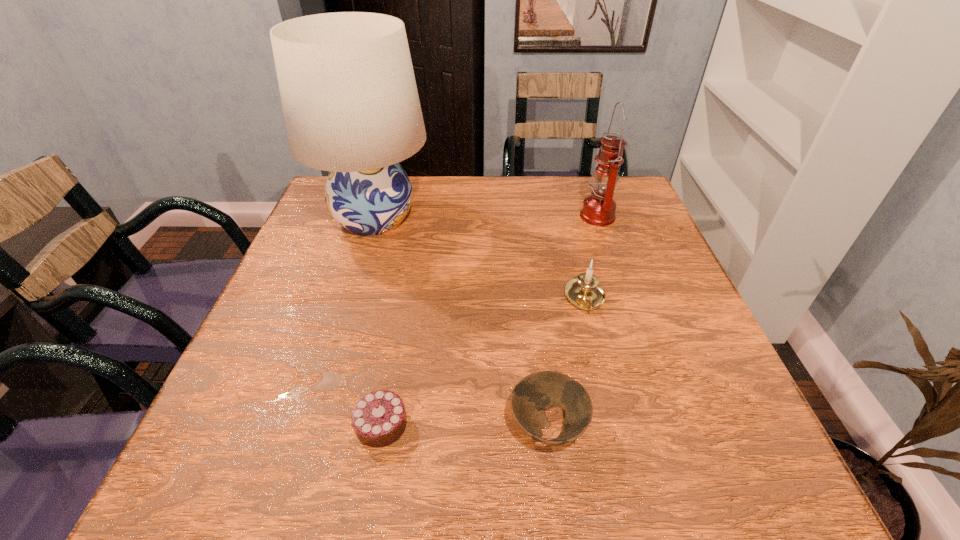
Locate an element on the screen. The width and height of the screenshot is (960, 540). lampshade is located at coordinates (350, 102).

Locate an element on the screen. The height and width of the screenshot is (540, 960). the fourth shortest object is located at coordinates (599, 208).

This screenshot has height=540, width=960. Find the location of `the third farthest object`. the third farthest object is located at coordinates (584, 291).

I want to click on the third shortest object, so click(x=584, y=291).

Identify the location of the fourth tallest object. This screenshot has width=960, height=540. (535, 393).

This screenshot has width=960, height=540. What are the coordinates of `the third object from left to right` in the screenshot? It's located at (535, 393).

At what (x,y) coordinates should I click in order to perform the action: click on the shortest object. Please return your answer as a coordinate pair (x, y). The height and width of the screenshot is (540, 960). Looking at the image, I should click on (379, 419).

Image resolution: width=960 pixels, height=540 pixels. I want to click on free space located 0.220m on the front-facing side of the lampshade, so click(x=515, y=218).

At what (x,y) coordinates should I click in order to perform the action: click on vacant area located 0.180m on the front of the oil lamp. Please return your answer as a coordinate pair (x, y). Looking at the image, I should click on (618, 277).

The width and height of the screenshot is (960, 540). I want to click on vacant space located on the handle side of the third nearest object, so click(x=595, y=338).